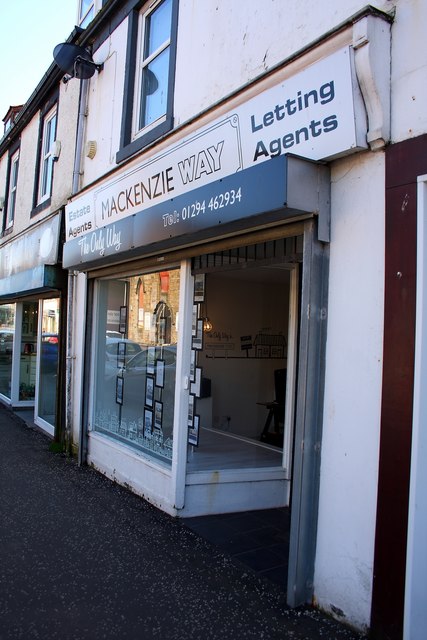
Find the location of `picture frame`. picture frame is located at coordinates [119, 403].